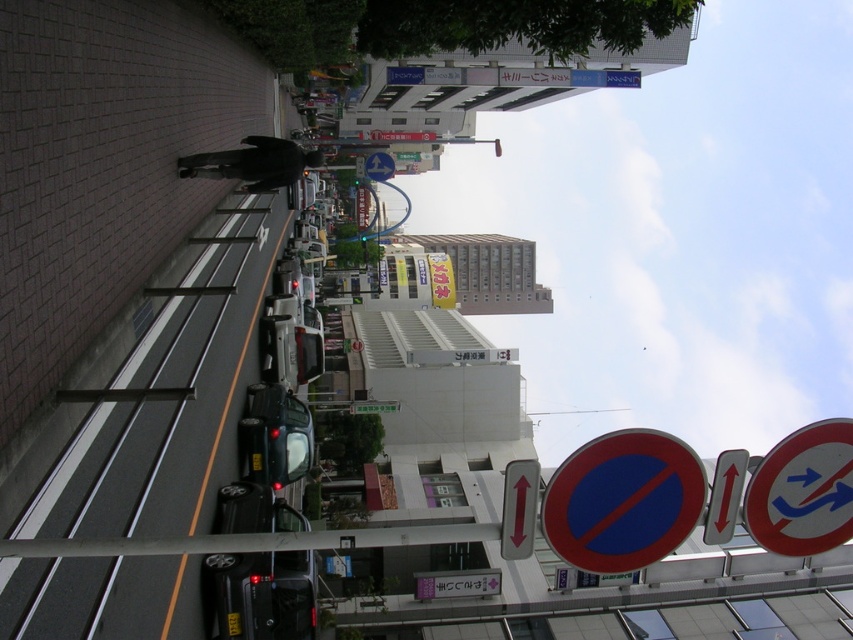
Question: Which of the following is the farthest from the observer?

Choices:
 (A) (x=589, y=493)
 (B) (x=531, y=548)

Answer: (B)

Question: Can you confirm if red plastic arrow at center is positioned above matte blue arrow at center?

Choices:
 (A) no
 (B) yes

Answer: (A)

Question: Does smooth plastic circle at center appear over red plastic arrow at center?

Choices:
 (A) yes
 (B) no

Answer: (B)

Question: Among these objects, which one is farthest from the camera?

Choices:
 (A) red plastic arrow at center
 (B) matte blue arrow at center

Answer: (B)

Question: Which object is closer to the camera taking this photo?

Choices:
 (A) red plastic arrow at center
 (B) matte blue arrow at center
 (C) smooth plastic circle at center

Answer: (A)

Question: In this image, where is smooth plastic circle at center located relative to red plastic arrow at center?

Choices:
 (A) left
 (B) right

Answer: (B)